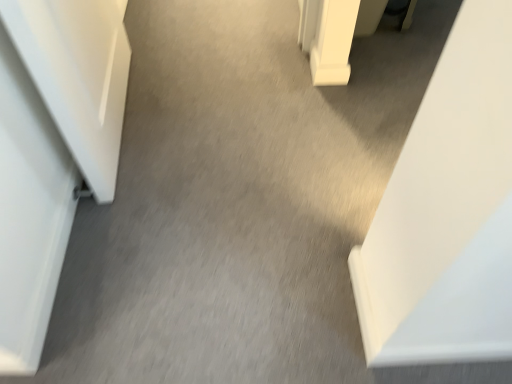
At what (x,y) coordinates should I click in order to perform the action: click on white matte door at right. Please return your answer as a coordinate pair (x, y). The height and width of the screenshot is (384, 512). Looking at the image, I should click on (447, 211).

The width and height of the screenshot is (512, 384). What do you see at coordinates (447, 211) in the screenshot?
I see `white matte door at right` at bounding box center [447, 211].

The image size is (512, 384). I want to click on white matte door at right, so click(447, 211).